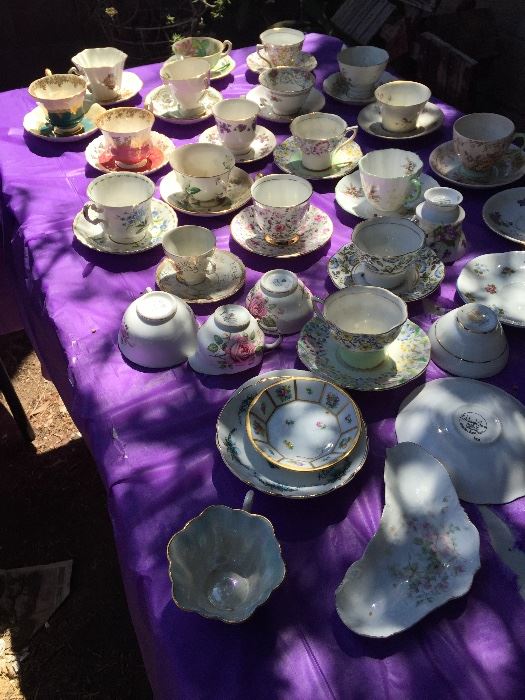
At what (x,y) coordinates should I click in order to perform the action: click on plates. Please return your answer as a coordinate pair (x, y). The image size is (525, 700). Looking at the image, I should click on (456, 428), (506, 283), (510, 222).